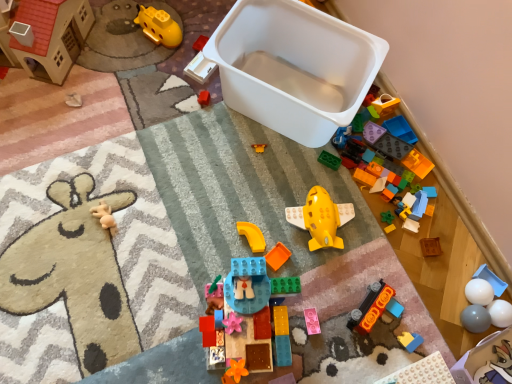
I want to click on vacant space situated on the left part of white plastic storage box at upper center, the 1th storage box when ordered from left to right, so click(165, 110).